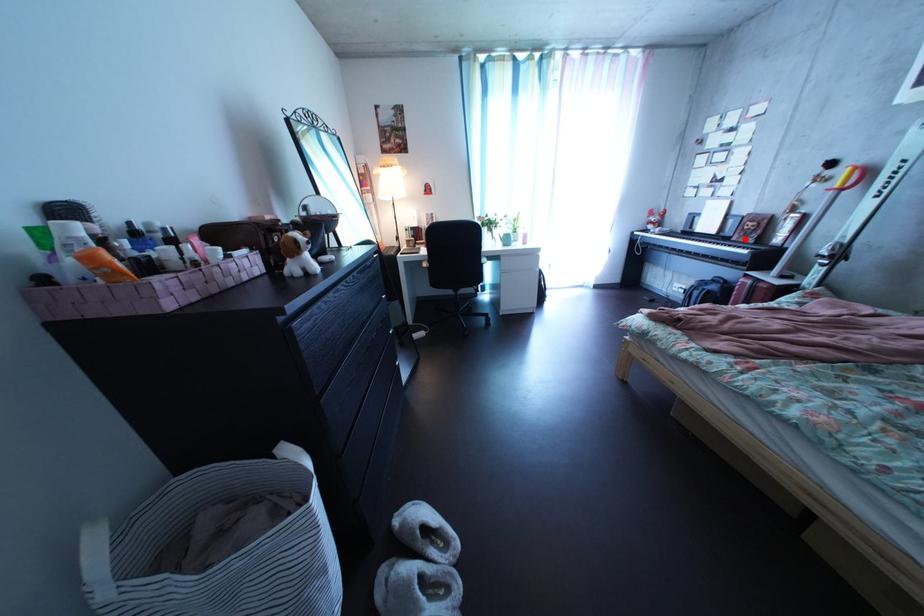
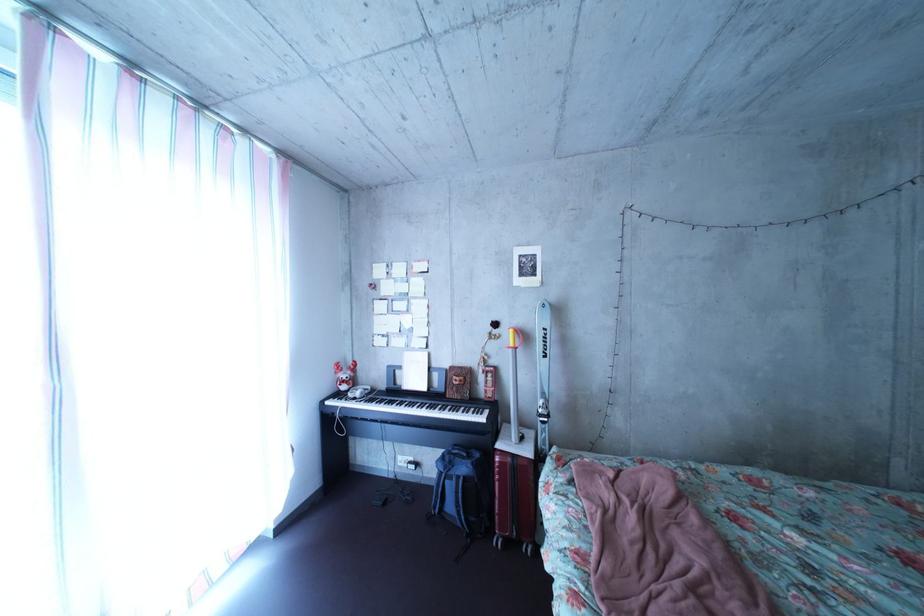
The point at the highlighted location is marked in the first image. Where is the corresponding point in the second image?

(452, 392)